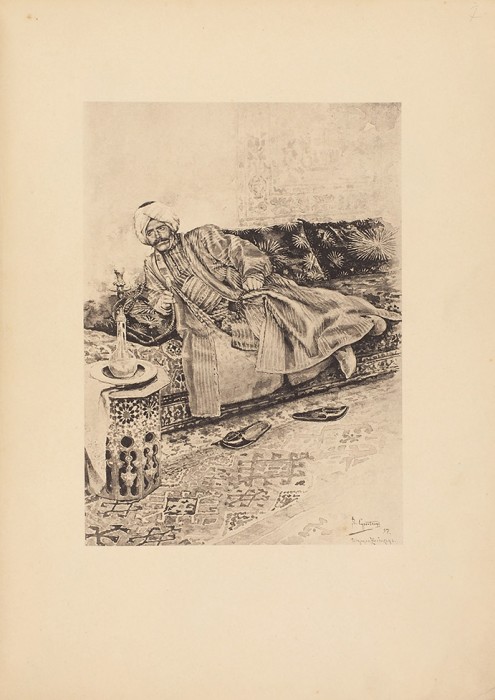
Where is `large pillow to left of man on sofa`? The image size is (495, 700). large pillow to left of man on sofa is located at coordinates (157, 325), (104, 316).